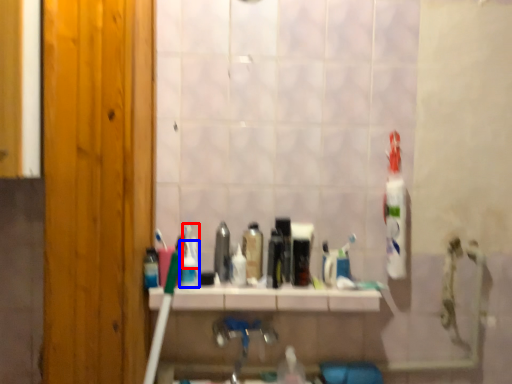
Question: Which object appears farthest to the camera in this image, toothpaste (highlighted by a red box) or mouthwash (highlighted by a blue box)?

Choices:
 (A) toothpaste
 (B) mouthwash

Answer: (A)